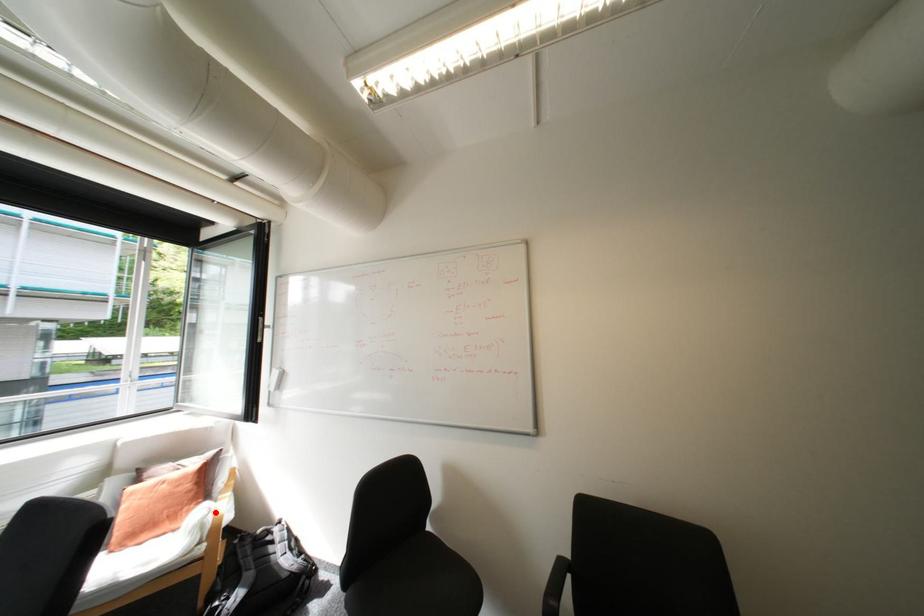
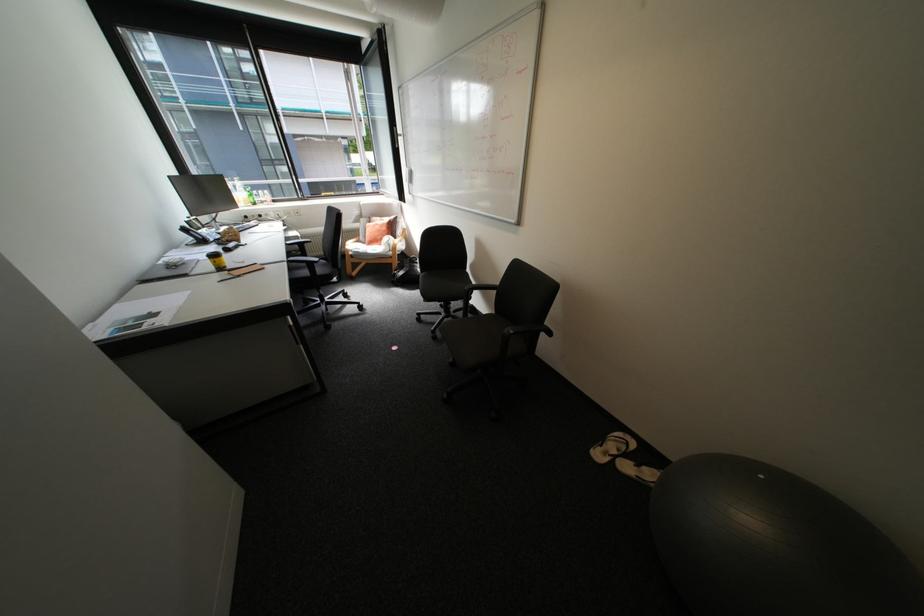
Find the pixel in the second image that matches the highlighted location in the first image.

(397, 238)